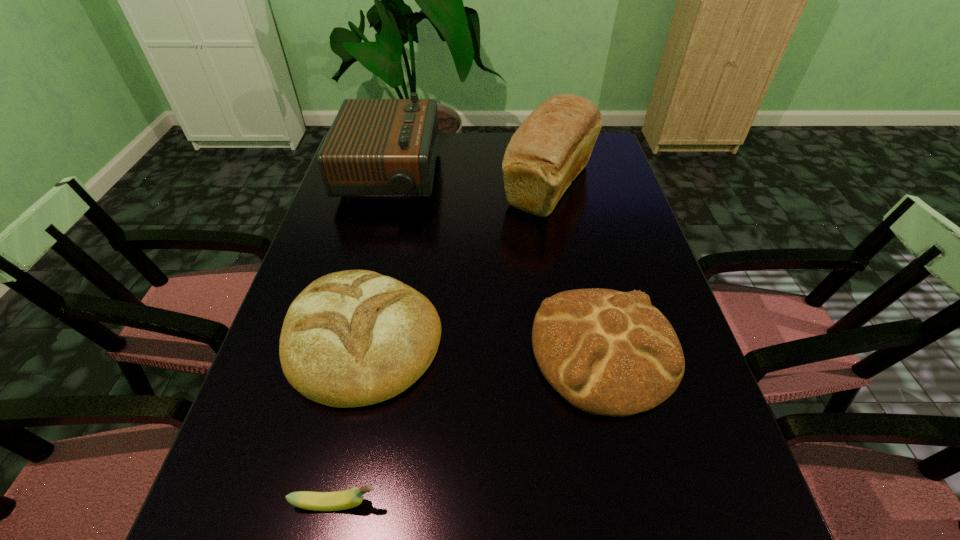
The width and height of the screenshot is (960, 540). I want to click on unoccupied position between the tallest object and the fourth shortest object, so click(469, 181).

I want to click on vacant region between the second tallest object and the tallest object, so click(469, 181).

I want to click on empty location between the banana and the tallest bread, so (443, 345).

Locate an element on the screen. The width and height of the screenshot is (960, 540). free point between the radio receiver and the leftmost bread is located at coordinates (376, 258).

Find the location of a particular element. The height and width of the screenshot is (540, 960). the second closest object to the radio receiver is located at coordinates (352, 338).

Locate which object ranks third in proximity to the fourth shortest object. Please provide its 2D coordinates. Your answer should be formatted as a tuple, i.e. [(x, y)], where the tuple contains the x and y coordinates of a point satisfying the conditions above.

[(611, 353)]

Choose which bread is the second nearest neighbor to the leftmost bread. Please provide its 2D coordinates. Your answer should be formatted as a tuple, i.e. [(x, y)], where the tuple contains the x and y coordinates of a point satisfying the conditions above.

[(551, 147)]

Choose which bread is the second nearest neighbor to the radio receiver. Please provide its 2D coordinates. Your answer should be formatted as a tuple, i.e. [(x, y)], where the tuple contains the x and y coordinates of a point satisfying the conditions above.

[(352, 338)]

I want to click on free space that satisfies the following two spatial constraints: 1. on the back side of the farthest bread; 2. on the tuning display of the radio receiver, so click(548, 177).

You are a GUI agent. You are given a task and a screenshot of the screen. Output one action in this format:
    pyautogui.click(x=<x>, y=<y>)
    Task: Click on the free space that satisfies the following two spatial constraints: 1. on the back side of the leftmost bread; 2. on the left side of the farthest bread
    
    Given the screenshot: What is the action you would take?
    pos(398,185)